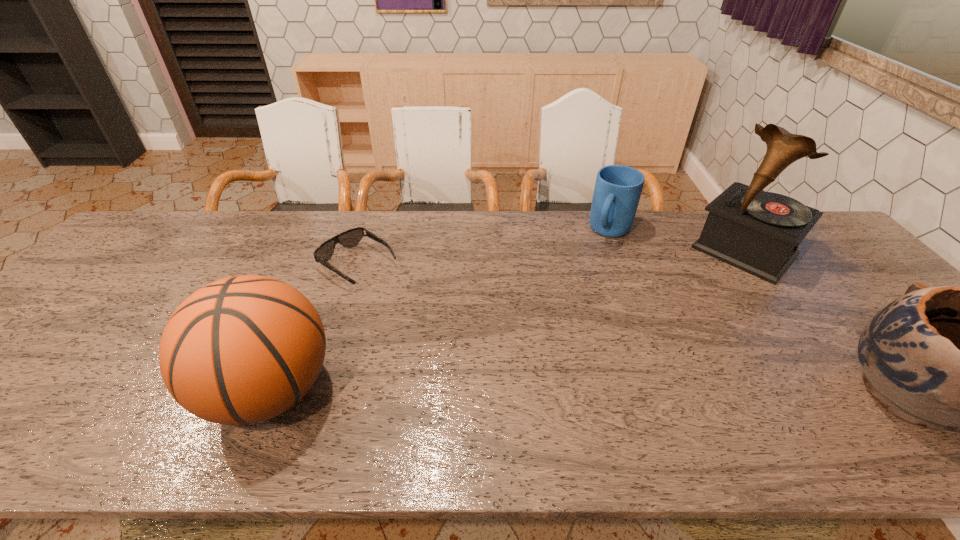
Locate an element on the screen. The width and height of the screenshot is (960, 540). basketball is located at coordinates 244,349.

Locate an element on the screen. This screenshot has height=540, width=960. the third object from right to left is located at coordinates (617, 191).

Where is `the fourth tallest object`? The height and width of the screenshot is (540, 960). the fourth tallest object is located at coordinates (617, 191).

I want to click on sunglasses, so click(x=352, y=237).

Where is `phonograph_record`? phonograph_record is located at coordinates (758, 232).

You are a GUI agent. You are given a task and a screenshot of the screen. Output one action in this format:
    pyautogui.click(x=<x>, y=<y>)
    Task: Click on the free spot located 0.350m on the back of the basketball
    This screenshot has height=540, width=960.
    Given the screenshot: What is the action you would take?
    pyautogui.click(x=328, y=252)

Locate an element on the screen. This screenshot has width=960, height=540. vacant area situated on the side of the mug with the handle is located at coordinates (571, 307).

The image size is (960, 540). Find the location of `vacant region located 0.200m on the side of the mug with the handle`. vacant region located 0.200m on the side of the mug with the handle is located at coordinates (584, 284).

The width and height of the screenshot is (960, 540). Find the location of `free space located on the side of the mug with the handle`. free space located on the side of the mug with the handle is located at coordinates (590, 274).

Where is `vacant space situated on the front-facing side of the sunglasses`? vacant space situated on the front-facing side of the sunglasses is located at coordinates (443, 322).